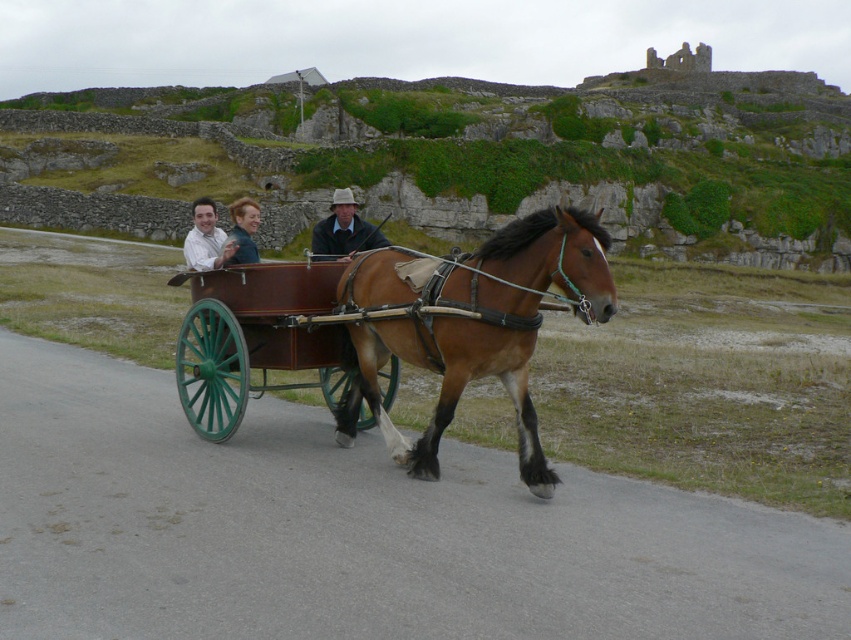
Question: Is the position of matte white shirt at center less distant than that of light brown leather jacket at center?

Choices:
 (A) no
 (B) yes

Answer: (B)

Question: Which object is farther from the camera taking this photo?

Choices:
 (A) blonde hair at center
 (B) matte white shirt at center
 (C) brown glossy horse at center

Answer: (B)

Question: Considering the real-world distances, which object is closest to the light brown leather jacket at center?

Choices:
 (A) blonde hair at center
 (B) brown glossy horse at center

Answer: (A)

Question: Can you confirm if wooden wagon at center is positioned below light brown leather jacket at center?

Choices:
 (A) yes
 (B) no

Answer: (A)

Question: Estimate the real-world distances between objects in this image. Which object is farther from the wooden wagon at center?

Choices:
 (A) brown glossy horse at center
 (B) matte white shirt at center
 (C) blonde hair at center
 (D) light brown leather jacket at center

Answer: (D)

Question: Does brown glossy horse at center appear on the left side of light brown leather jacket at center?

Choices:
 (A) yes
 (B) no

Answer: (B)